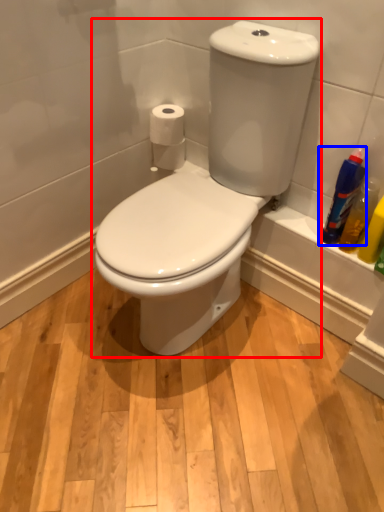
Question: Which of the following is the closest to the observer, toilet (highlighted by a red box) or cleaning product (highlighted by a blue box)?

Choices:
 (A) toilet
 (B) cleaning product

Answer: (A)